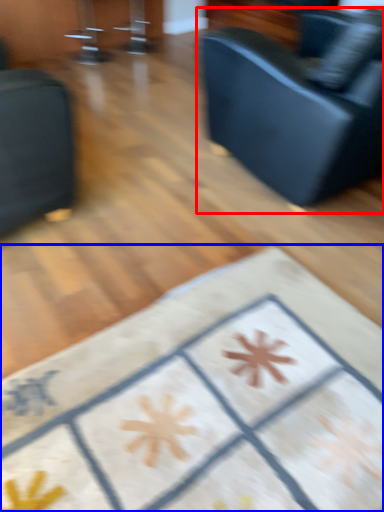
Question: Which object appears closest to the camera in this image, studio couch (highlighted by a red box) or furniture (highlighted by a blue box)?

Choices:
 (A) studio couch
 (B) furniture

Answer: (B)